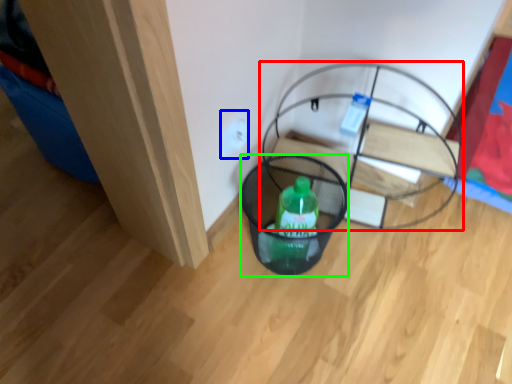
Question: Considering the real-world distances, which object is closest to furniture (highlighted by a red box)? electric outlet (highlighted by a blue box) or basket (highlighted by a green box).

Choices:
 (A) electric outlet
 (B) basket

Answer: (B)